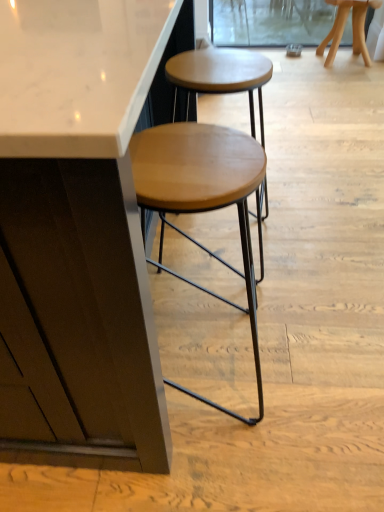
Locate an element on the screen. empty space that is ontop of wooden seat at center, acting as the second stool starting from the top (from a real-world perspective) is located at coordinates (185, 162).